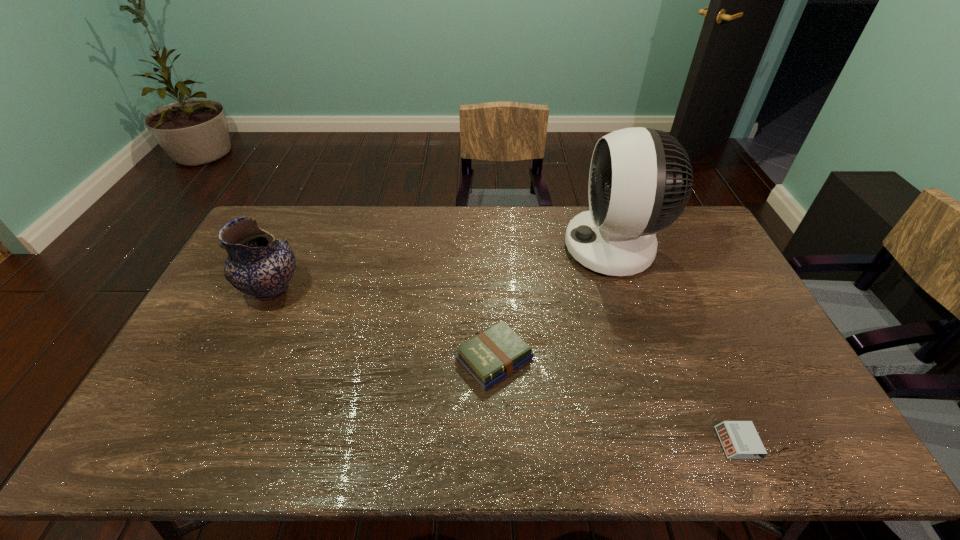
I want to click on free space between the tallest object and the nearest object, so click(x=676, y=345).

Where is `free space between the leftmost object and the second shortest object`? free space between the leftmost object and the second shortest object is located at coordinates (383, 324).

Image resolution: width=960 pixels, height=540 pixels. I want to click on vacant space that's between the nearest object and the fan, so click(x=676, y=345).

Locate an element on the screen. Image resolution: width=960 pixels, height=540 pixels. free area in between the nearest object and the third tallest object is located at coordinates (616, 401).

At what (x,y) coordinates should I click in order to perform the action: click on free space between the second tallest object and the fan. Please return your answer as a coordinate pair (x, y). This screenshot has width=960, height=540. Looking at the image, I should click on (443, 269).

Find the location of a particular element. vacant space in between the second nearest object and the fan is located at coordinates (554, 303).

Identify the location of free spot between the third farthest object and the pottery. (383, 324).

Identify the location of free space between the nearest object and the book. This screenshot has width=960, height=540. (616, 401).

Identify the location of vacant area between the alarm clock and the book. This screenshot has width=960, height=540. [616, 401].

Locate which object ranks second in proximity to the fan. Please provide its 2D coordinates. Your answer should be formatted as a tuple, i.e. [(x, y)], where the tuple contains the x and y coordinates of a point satisfying the conditions above.

[(740, 440)]